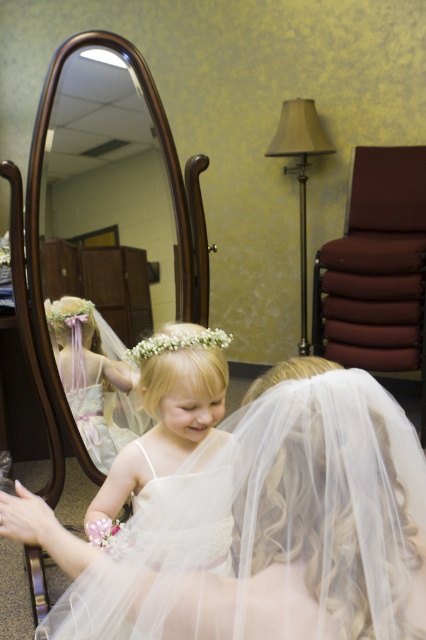
You are a photographer standing in the center of the room. You want to take a photo of both the white tulle dress at lower center and the pastel pink tulle dress at center. Considering the distance between them, will you be able to fit both dresses in your camera frame if your camera has a maximum field of view of 25 inches?

The distance between the white tulle dress at lower center and the pastel pink tulle dress at center is 27.03 inches, which exceeds the camera frame of 25 inches. Therefore, you won not be able to fit both dresses in the frame.

You are standing in the dressing room and need to move from point A to point B. Point A is at coordinates point (278, 429) and point B is at coordinates point (155, 340). Since point A is in front of point B, will you have to walk around any objects to reach point B from point A?

Since point A is in front of point B, you will have to walk around point A to reach point B from point A.

You are a photographer setting up for a wedding photoshoot. You need to ensure that both the white tulle veil at lower center and the white tulle dress at lower center are fully visible in the frame. Given their sizes, which one requires more space in the composition?

The white tulle veil at lower center is larger in size than the white tulle dress at lower center, so it requires more space in the composition to ensure it is fully visible.